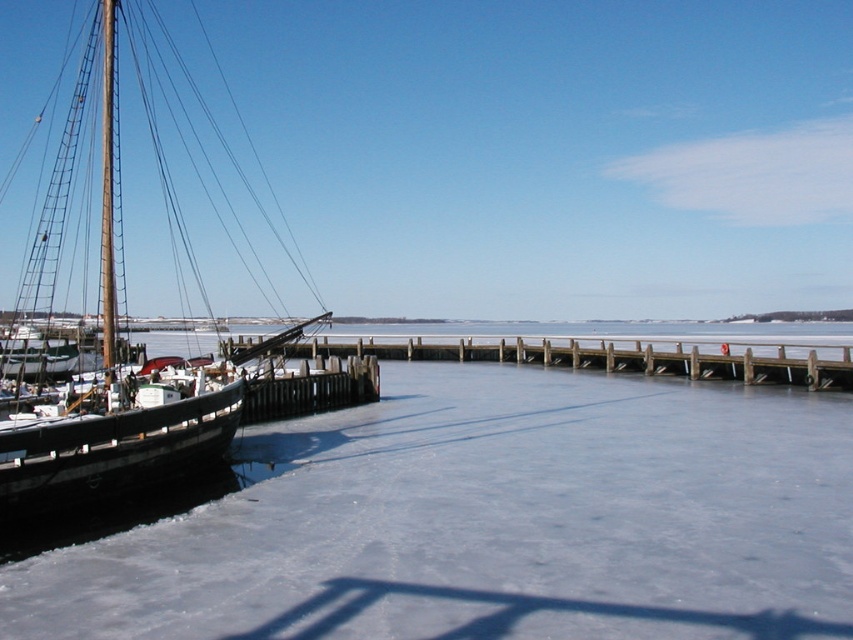
You are standing on the wooden pier and see both the wooden sailboat at left and the white matte sailboat at left. Which one is closer to the left edge of the dock?

The wooden sailboat at left is positioned on the left side of the white matte sailboat at left, so it is closer to the left edge of the dock.

You are standing at the wooden pier looking towards the frozen water. There are two points marked in the image. Which point, point (x=283, y=540) or point (x=109, y=301), is closer to you?

Point (x=283, y=540) is closer to the camera than point (x=109, y=301).

From the picture: You are standing on the frozen lake and see the white matte snow at center and the wooden sailboat at left. Which object is closer to your feet?

The white matte snow at center is closer to your feet because it is positioned below the wooden sailboat at left, meaning it is located beneath it and therefore nearer to the observer.